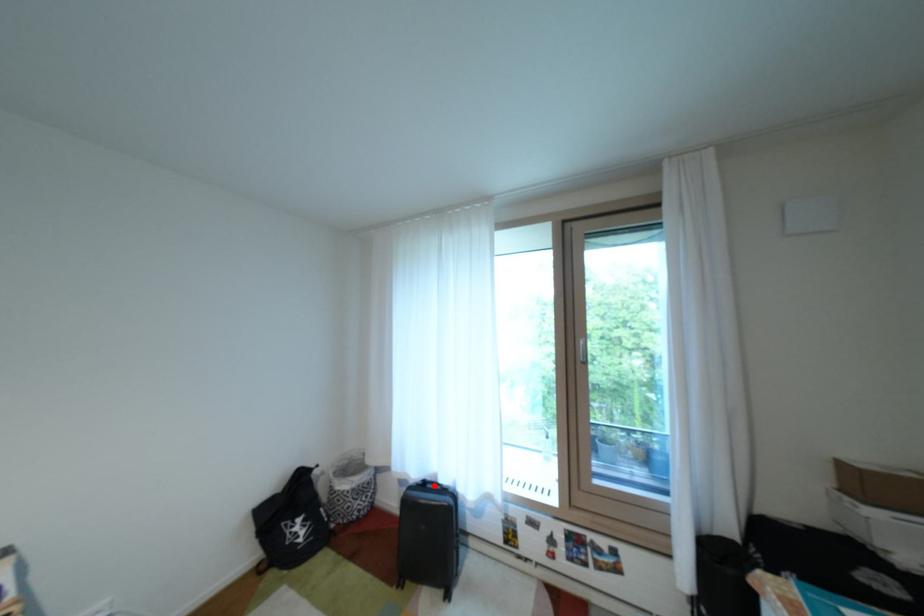
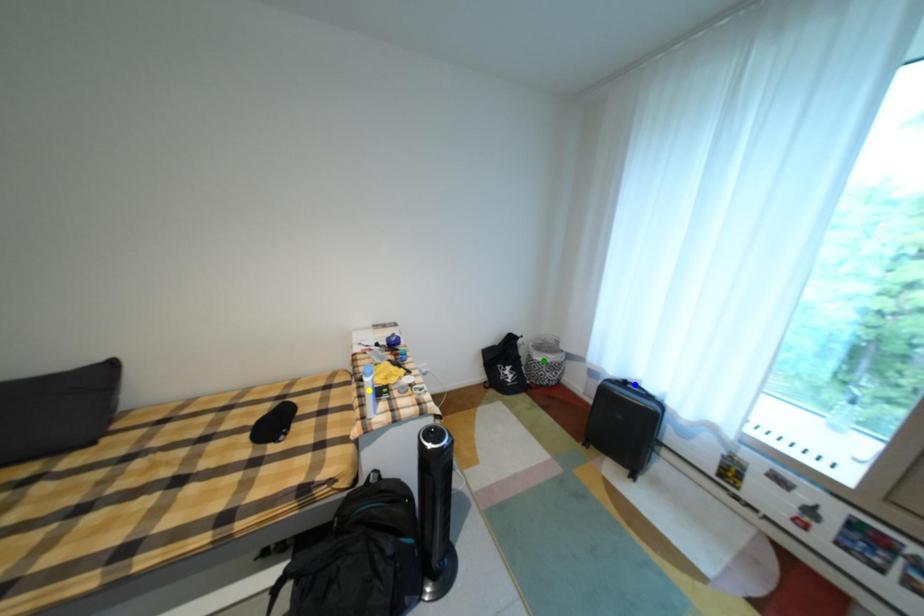
Question: I am providing you with two images of the same scene from different viewpoints. A red point is marked on the first image. You are given multiple points on the second image. Which spot in image 2 lines up with the point in image 1?

Choices:
 (A) blue point
 (B) yellow point
 (C) green point

Answer: (A)